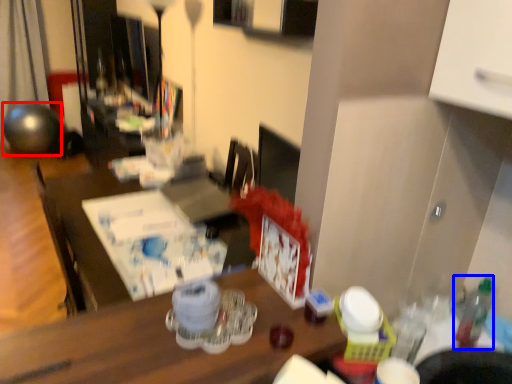
Question: Which of the following is the closest to the observer, ball (highlighted by a red box) or bottle (highlighted by a blue box)?

Choices:
 (A) ball
 (B) bottle

Answer: (B)